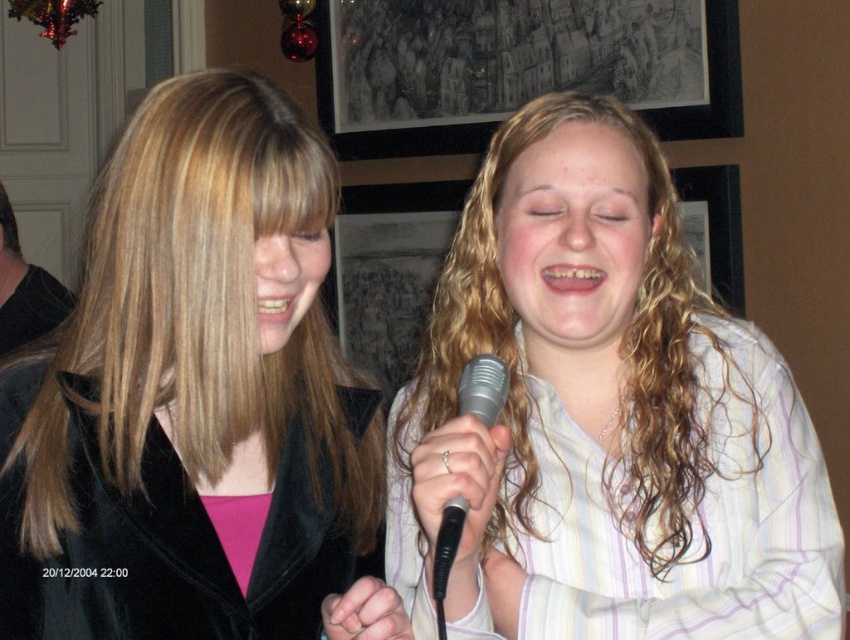
Who is lower down, matte black jacket at left or silver metallic microphone at center?

silver metallic microphone at center is lower down.

Is matte black jacket at left smaller than silver metallic microphone at center?

Incorrect, matte black jacket at left is not smaller in size than silver metallic microphone at center.

Who is more distant from viewer, (259, 492) or (474, 394)?

Positioned behind is point (259, 492).

Identify the location of matte black jacket at left. This screenshot has width=850, height=640. (197, 401).

Who is positioned more to the left, white striped shirt at center or silver metallic microphone at center?

silver metallic microphone at center is more to the left.

Can you confirm if white striped shirt at center is bigger than silver metallic microphone at center?

Indeed, white striped shirt at center has a larger size compared to silver metallic microphone at center.

Which is in front, point (557, 600) or point (496, 417)?

Positioned in front is point (496, 417).

Locate an element on the screen. The image size is (850, 640). white striped shirt at center is located at coordinates (604, 417).

Consider the image. Between white striped shirt at center and matte black jacket at left, which one appears on the left side from the viewer's perspective?

Positioned to the left is matte black jacket at left.

Who is taller, white striped shirt at center or matte black jacket at left?

white striped shirt at center is taller.

Is point (404, 550) positioned behind point (153, 490)?

Yes, point (404, 550) is behind point (153, 490).

The width and height of the screenshot is (850, 640). I want to click on white striped shirt at center, so click(604, 417).